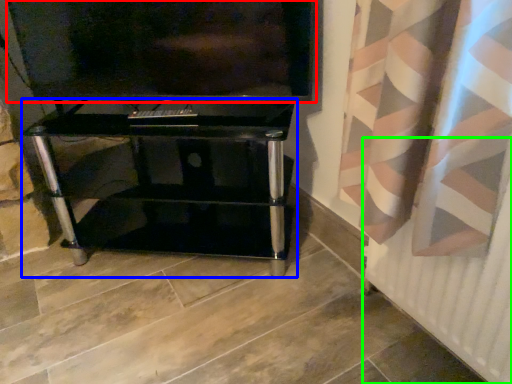
Question: Which object is the farthest from television (highlighted by a red box)? Choose among these: furniture (highlighted by a blue box) or radiator (highlighted by a green box).

Choices:
 (A) furniture
 (B) radiator

Answer: (B)